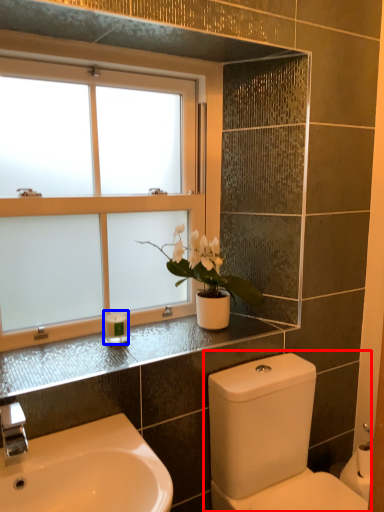
Question: Among these objects, which one is farthest to the camera, toilet (highlighted by a red box) or toiletry (highlighted by a blue box)?

Choices:
 (A) toilet
 (B) toiletry

Answer: (B)